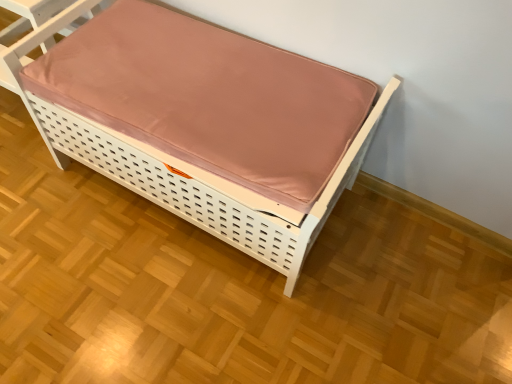
Describe the element at coordinates (201, 122) in the screenshot. Image resolution: width=512 pixels, height=384 pixels. I see `matte pink mattress at center` at that location.

I want to click on matte pink mattress at center, so click(201, 122).

Locate an element on the screen. matte pink mattress at center is located at coordinates (201, 122).